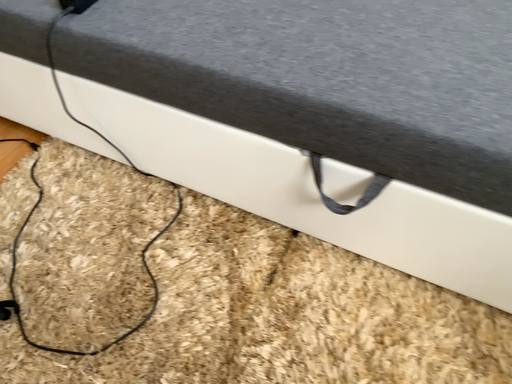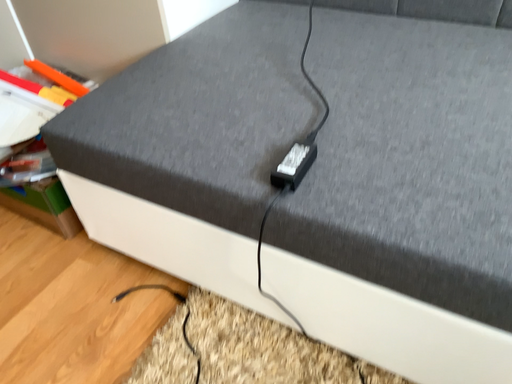
Question: Which way did the camera rotate in the video?

Choices:
 (A) rotated downward
 (B) rotated upward

Answer: (B)